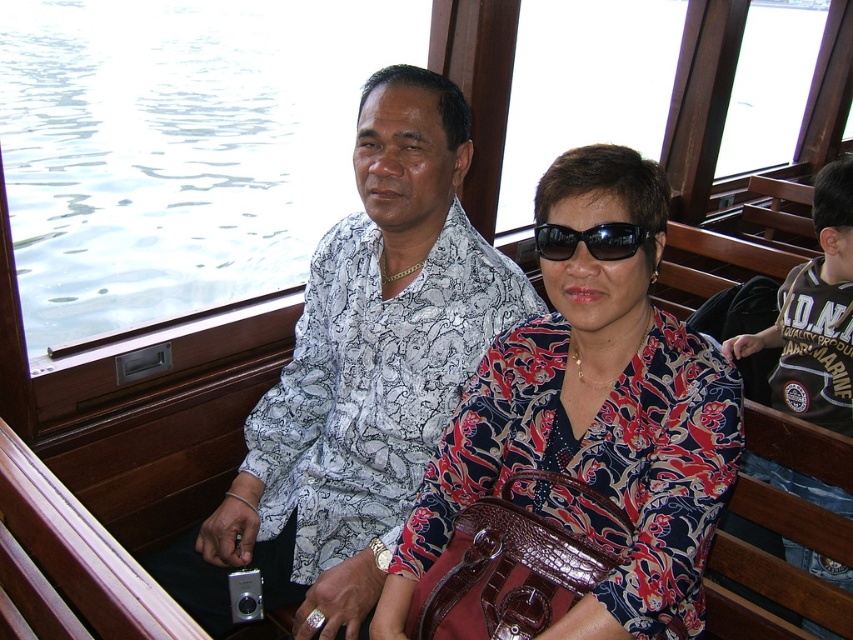
Does white printed shirt at center have a greater height compared to silver metallic camera at lower left?

Indeed, white printed shirt at center has a greater height compared to silver metallic camera at lower left.

Is point (347, 401) less distant than point (218, 589)?

No, it is not.

Locate an element on the screen. The width and height of the screenshot is (853, 640). white printed shirt at center is located at coordinates (363, 372).

Find the location of a particular element. The width and height of the screenshot is (853, 640). floral-patterned fabric at center is located at coordinates [x=593, y=420].

The height and width of the screenshot is (640, 853). Describe the element at coordinates (193, 582) in the screenshot. I see `silver metallic camera at lower left` at that location.

Which is below, silver metallic camera at lower left or black plastic sunglasses at center?

Positioned lower is silver metallic camera at lower left.

Image resolution: width=853 pixels, height=640 pixels. Find the location of `silver metallic camera at lower left`. silver metallic camera at lower left is located at coordinates (193, 582).